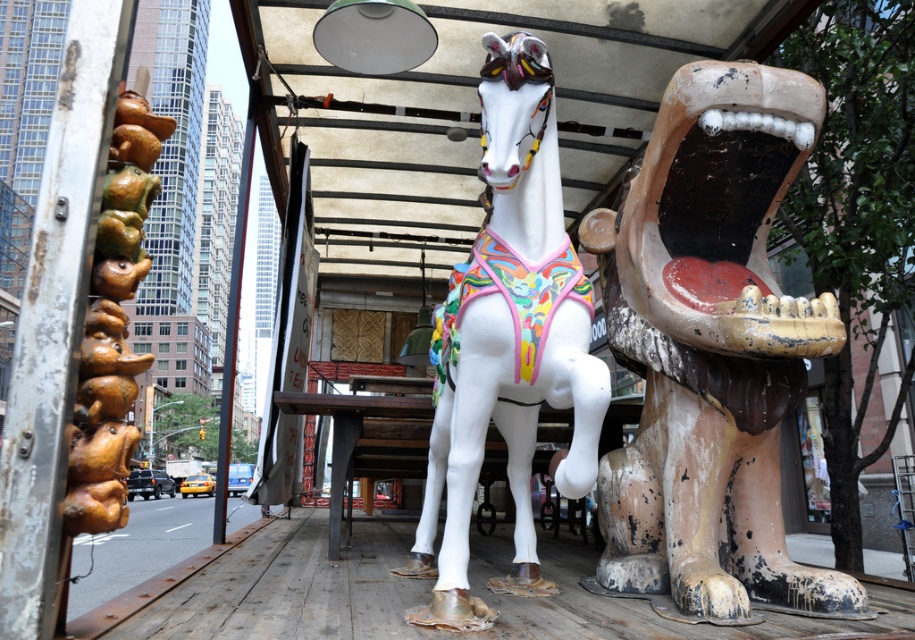
Between point (755, 83) and point (122, 360), which one is positioned in front?

Point (122, 360) is more forward.

Between painted wood lion at right and brown glazed ceramic dog at left, which one is positioned lower?

painted wood lion at right is lower down.

Which is in front, point (842, 330) or point (151, 138)?

Point (151, 138)

At what (x,y) coordinates should I click in order to perform the action: click on painted wood lion at right. Please return your answer as a coordinate pair (x, y). Looking at the image, I should click on (711, 349).

Is painted wood lion at right positioned behind white glossy horse at center?

Yes.

Is painted wood lion at right bigger than white glossy horse at center?

No.

Identify the location of painted wood lion at right. (711, 349).

You are a GUI agent. You are given a task and a screenshot of the screen. Output one action in this format:
    pyautogui.click(x=<x>, y=<y>)
    Task: Click on the painted wood lion at right
    This screenshot has width=915, height=640.
    Given the screenshot: What is the action you would take?
    pyautogui.click(x=711, y=349)

Is point (461, 269) positioned before point (95, 490)?

No, (461, 269) is behind (95, 490).

Is white glossy horse at center above brown glazed ceramic dog at left?

Incorrect, white glossy horse at center is not positioned above brown glazed ceramic dog at left.

Find the location of a particular element. The image size is (915, 640). white glossy horse at center is located at coordinates click(507, 340).